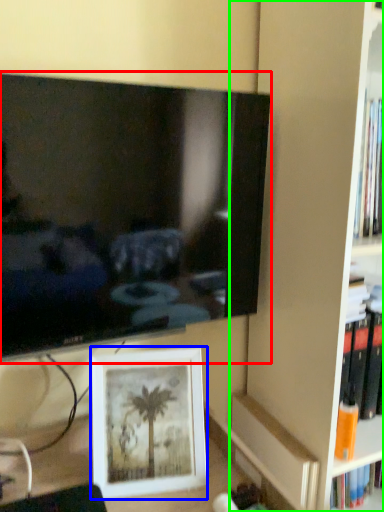
Question: Which object is positioned closest to television (highlighted by a red box)? Select from picture frame (highlighted by a blue box) and bookshelf (highlighted by a green box).

Choices:
 (A) picture frame
 (B) bookshelf

Answer: (A)